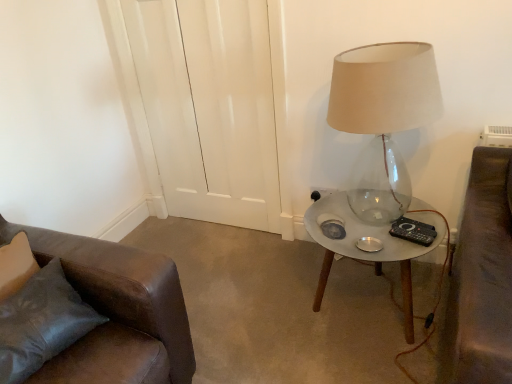
The width and height of the screenshot is (512, 384). Identify the location of black plastic remote control at right. (413, 231).

This screenshot has height=384, width=512. What do you see at coordinates (374, 252) in the screenshot? I see `metallic glass table at right` at bounding box center [374, 252].

What is the approximate width of leather couch at lower left?

leather couch at lower left is 7.22 inches wide.

From the picture: Measure the distance between point [375,66] and camera.

Point [375,66] is 4.36 feet away from camera.

This screenshot has width=512, height=384. Describe the element at coordinates (384, 89) in the screenshot. I see `translucent glass lamp at right` at that location.

Locate an element on the screen. This screenshot has height=384, width=512. black plastic remote control at right is located at coordinates (413, 231).

Is metallic glass table at right outside of black plastic remote control at right?

Indeed, metallic glass table at right is completely outside black plastic remote control at right.

Locate an element on the screen. The image size is (512, 384). remote control above the metallic glass table at right (from the image's perspective) is located at coordinates (413, 231).

Between metallic glass table at right and black plastic remote control at right, which one has smaller size?

With smaller size is black plastic remote control at right.

From a real-world perspective, is metallic glass table at right located beneath black plastic remote control at right?

Correct, in the physical world, metallic glass table at right is lower than black plastic remote control at right.

Can you confirm if leather couch at lower left is shorter than black plastic socket at lower right?

No, leather couch at lower left is not shorter than black plastic socket at lower right.

Is leather couch at lower left positioned behind black plastic socket at lower right?

No, leather couch at lower left is closer to the viewer.

Could you tell me if leather couch at lower left is facing black plastic socket at lower right?

No, leather couch at lower left is not oriented towards black plastic socket at lower right.

Which of these two, leather couch at lower left or black plastic socket at lower right, is wider?

Wider between the two is leather couch at lower left.

The width and height of the screenshot is (512, 384). In order to click on remote control directly beneath the translucent glass lamp at right (from a real-world perspective) in this screenshot , I will do `click(413, 231)`.

Is translucent glass lamp at right with black plastic remote control at right?

No.

Can you confirm if translucent glass lamp at right is thinner than black plastic remote control at right?

No, translucent glass lamp at right is not thinner than black plastic remote control at right.

Is metallic glass table at right facing towards black plastic socket at lower right?

No, metallic glass table at right is not oriented towards black plastic socket at lower right.

Is metallic glass table at right far from black plastic socket at lower right?

Actually, metallic glass table at right and black plastic socket at lower right are a little close together.

Is metallic glass table at right bigger than black plastic socket at lower right?

Indeed, metallic glass table at right has a larger size compared to black plastic socket at lower right.

Is metallic glass table at right positioned in front of black plastic socket at lower right?

Yes, metallic glass table at right is closer to the viewer.

Considering the sizes of objects metallic glass table at right and translucent glass lamp at right in the image provided, who is bigger, metallic glass table at right or translucent glass lamp at right?

translucent glass lamp at right.

Can you see metallic glass table at right touching translucent glass lamp at right?

No, metallic glass table at right is not next to translucent glass lamp at right.

Is metallic glass table at right positioned with its back to translucent glass lamp at right?

metallic glass table at right is not turned away from translucent glass lamp at right.

From the image's perspective, who appears lower, metallic glass table at right or translucent glass lamp at right?

metallic glass table at right, from the image's perspective.

Would you say leather couch at lower left is outside translucent glass lamp at right?

Yes, leather couch at lower left is outside of translucent glass lamp at right.

Is point (84, 252) closer or farther from the camera than point (386, 168)?

Point (84, 252) is positioned closer to the camera compared to point (386, 168).

From a real-world perspective, which is physically below, leather couch at lower left or translucent glass lamp at right?

In real-world perspective, leather couch at lower left is lower.

In the image, is black plastic socket at lower right positioned in front of or behind translucent glass lamp at right?

black plastic socket at lower right is behind translucent glass lamp at right.

From a real-world perspective, is black plastic socket at lower right physically below translucent glass lamp at right?

Correct, in the physical world, black plastic socket at lower right is lower than translucent glass lamp at right.

Considering the sizes of black plastic socket at lower right and translucent glass lamp at right in the image, is black plastic socket at lower right bigger or smaller than translucent glass lamp at right?

Considering their sizes, black plastic socket at lower right takes up less space than translucent glass lamp at right.

Would you say translucent glass lamp at right is part of black plastic socket at lower right's contents?

Answer: No.

The width and height of the screenshot is (512, 384). What are the coordinates of `table in front of the black plastic remote control at right` in the screenshot? It's located at click(x=374, y=252).

Where is `electric outlet above the leather couch at lower left (from the image's perspective)`? electric outlet above the leather couch at lower left (from the image's perspective) is located at coordinates (320, 192).

Estimate the real-world distances between objects in this image. Which object is further from translucent glass lamp at right, black plastic socket at lower right or metallic glass table at right?

Based on the image, black plastic socket at lower right appears to be further to translucent glass lamp at right.

Considering their positions, is metallic glass table at right positioned closer to leather couch at lower left than black plastic socket at lower right?

Among the two, metallic glass table at right is located nearer to leather couch at lower left.

Considering their positions, is metallic glass table at right positioned further to black plastic remote control at right than leather couch at lower left?

leather couch at lower left.

From the image, which object appears to be farther from translucent glass lamp at right, metallic glass table at right or black plastic socket at lower right?

black plastic socket at lower right is further to translucent glass lamp at right.

Estimate the real-world distances between objects in this image. Which object is further from leather couch at lower left, black plastic socket at lower right or black plastic remote control at right?

black plastic remote control at right is further to leather couch at lower left.

Based on their spatial positions, is leather couch at lower left or black plastic remote control at right closer to translucent glass lamp at right?

Based on the image, black plastic remote control at right appears to be nearer to translucent glass lamp at right.

Looking at this image, based on their spatial positions, is black plastic socket at lower right or leather couch at lower left closer to black plastic remote control at right?

Among the two, black plastic socket at lower right is located nearer to black plastic remote control at right.

From the image, which object appears to be farther from black plastic socket at lower right, leather couch at lower left or translucent glass lamp at right?

leather couch at lower left is positioned further to the anchor black plastic socket at lower right.

At what (x,y) coordinates should I click in order to perform the action: click on electric outlet located between leather couch at lower left and metallic glass table at right in the left-right direction. Please return your answer as a coordinate pair (x, y). This screenshot has height=384, width=512. Looking at the image, I should click on (320, 192).

I want to click on table between leather couch at lower left and black plastic remote control at right from left to right, so (374, 252).

Image resolution: width=512 pixels, height=384 pixels. I want to click on remote control between translucent glass lamp at right and black plastic socket at lower right from front to back, so click(413, 231).

Identify the location of table located between translucent glass lamp at right and black plastic socket at lower right in the depth direction. The image size is (512, 384). (374, 252).